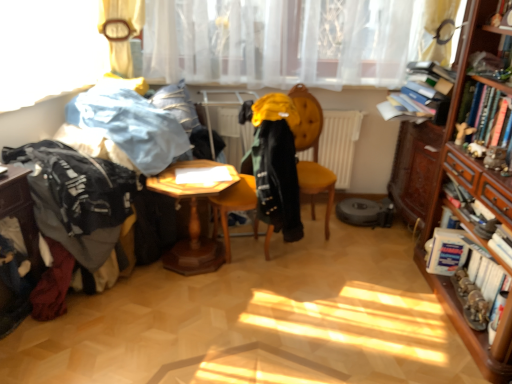
I want to click on vacant space that is in between wooden hexagonal table at lower left, the 1th table when ordered from left to right, and wooden bookcase at right, so click(x=277, y=319).